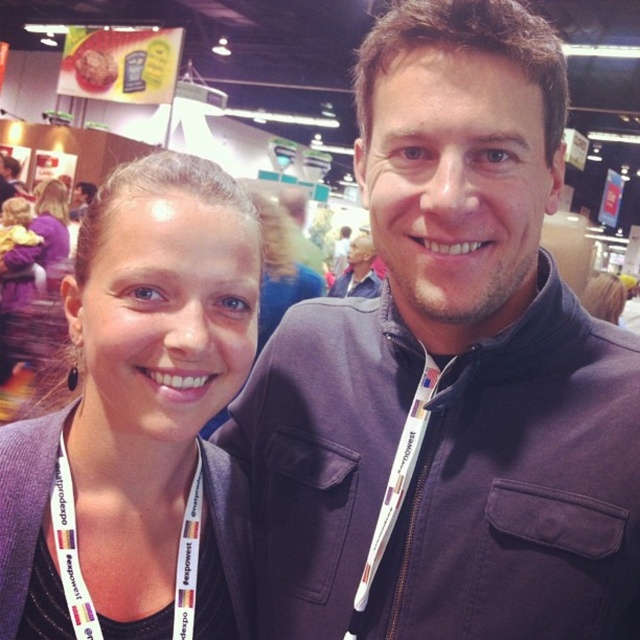
Which is above, dark blue jacket at center or matte gray neck at center?

matte gray neck at center is above.

I want to click on dark blue jacket at center, so click(449, 371).

Between point (381, 54) and point (440, 340), which one is positioned behind?

The point (440, 340) is behind.

The height and width of the screenshot is (640, 640). Find the location of `dark blue jacket at center`. dark blue jacket at center is located at coordinates (449, 371).

Does matte purple blazer at left have a lesser height compared to matte black neck at center?

No.

Is matte purple blazer at left closer to the viewer compared to matte black neck at center?

That is True.

The height and width of the screenshot is (640, 640). I want to click on matte purple blazer at left, so click(x=140, y=420).

Does point (163, 412) come farther from viewer compared to point (64, 541)?

No, it is not.

Who is higher up, matte black neck at center or white fabric lanyard at lower left?

Positioned higher is matte black neck at center.

Image resolution: width=640 pixels, height=640 pixels. Describe the element at coordinates (132, 440) in the screenshot. I see `matte black neck at center` at that location.

Locate an element on the screen. The width and height of the screenshot is (640, 640). matte black neck at center is located at coordinates (132, 440).